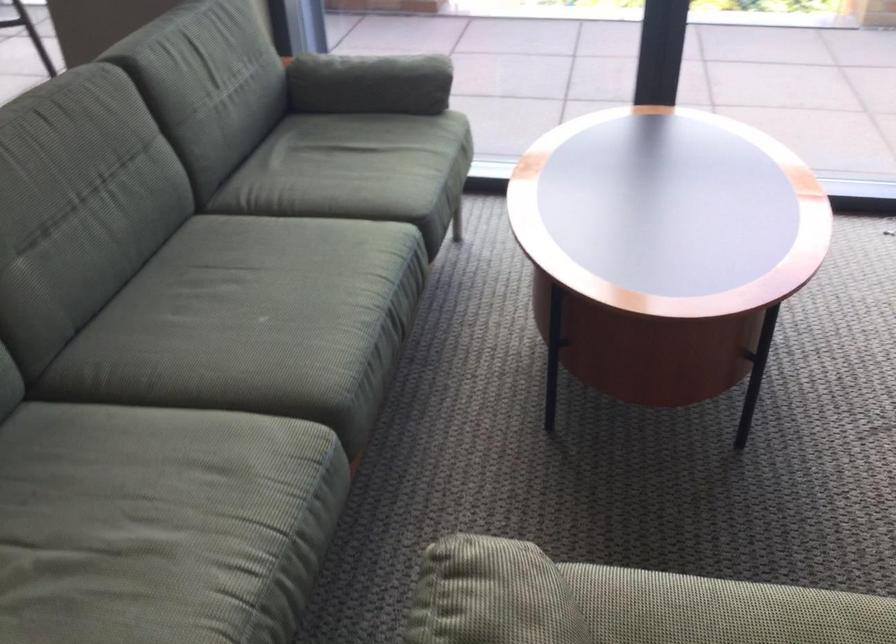
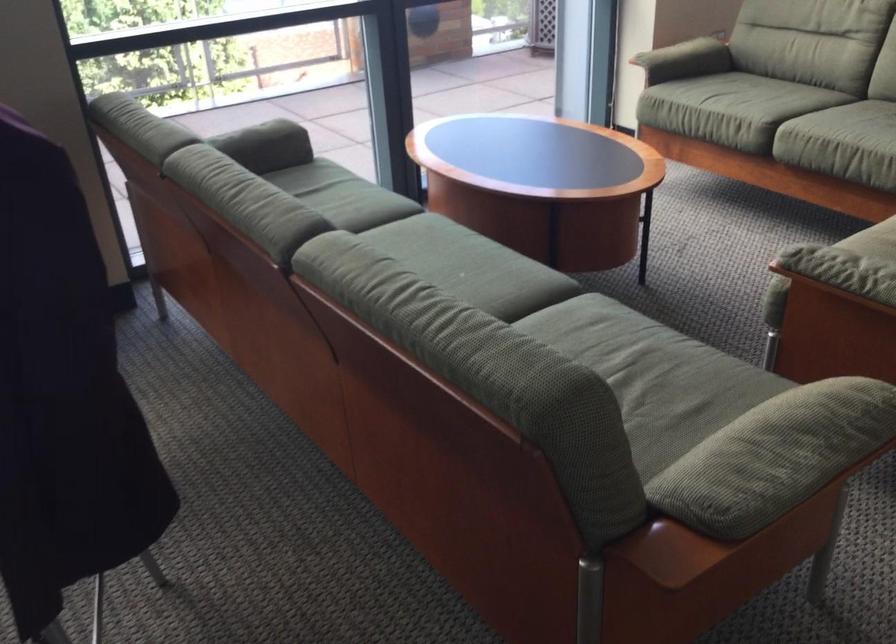
Locate, in the second image, the point that corresponds to (268,301) in the first image.

(442, 267)